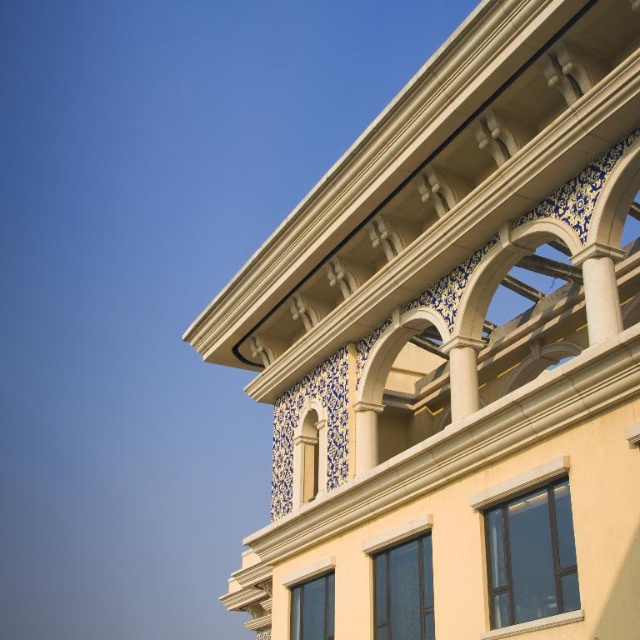
Does yellow stucco building at upper right have a greater height compared to matte cream tile at center?

Yes, yellow stucco building at upper right is taller than matte cream tile at center.

Who is more forward, (627,176) or (321,449)?

Point (627,176) is in front.

Is point (632, 572) positioned in front of point (321, 412)?

Yes, point (632, 572) is closer to viewer.

Find the location of `yellow stucco building at upper right`. yellow stucco building at upper right is located at coordinates (461, 339).

Is matte glass window at lower right positioned before matte cream tile at center?

Yes, it is in front of matte cream tile at center.

Which is above, matte glass window at lower right or matte cream tile at center?

matte cream tile at center is higher up.

Is point (518, 620) less distant than point (301, 488)?

Yes, point (518, 620) is closer to viewer.

In order to click on matte glass window at lower right in this screenshot , I will do `click(531, 557)`.

From the picture: Does clear glass window at lower center have a lesser height compared to matte glass window at center?

In fact, clear glass window at lower center may be taller than matte glass window at center.

Does clear glass window at lower center appear under matte glass window at center?

No, clear glass window at lower center is not below matte glass window at center.

Is point (428, 600) farther from camera compared to point (292, 611)?

No, it is in front of (292, 611).

Locate an element on the screen. clear glass window at lower center is located at coordinates coord(403,589).